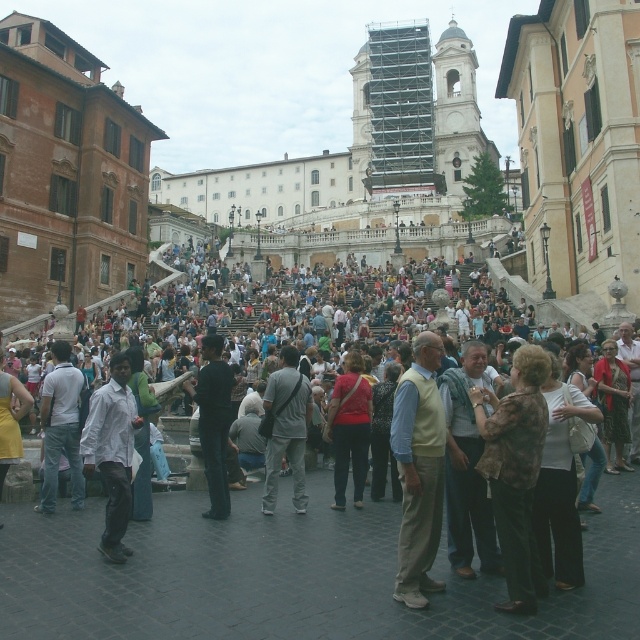
You are a photographer trying to capture a candid shot of the crowd at the Spanish Steps. You notice two people wearing a brown textured shirt at lower right and a gray cotton shirt at center. If you want to ensure both shirts are clearly visible in your photo, which shirt should you focus on to avoid blurriness due to size?

The gray cotton shirt at center is wider than the brown textured shirt at lower right, so focusing on the gray cotton shirt at center would ensure both are visible as it is larger and might be easier to focus on.

You are a photographer at the Spanish Steps. You want to take a photo of the brown textured shirt at lower right and the matte red sweater at center. Which of the two clothing items is shorter in height?

The brown textured shirt at lower right is shorter in height than the matte red sweater at center because it is not as tall as the matte red sweater at center.

You are a photographer standing at the Spanish Steps and notice two tourists wearing a brown textured shirt at lower right and a gray cotton shirt at center. Which tourist is positioned higher up in the scene?

The brown textured shirt at lower right is located above the gray cotton shirt at center, so the tourist wearing the brown textured shirt at lower right is positioned higher up in the scene.